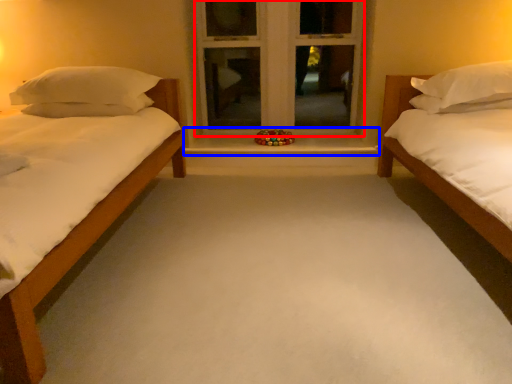
Question: Which object is further to the camera taking this photo, window frame (highlighted by a red box) or window sill (highlighted by a blue box)?

Choices:
 (A) window frame
 (B) window sill

Answer: (A)